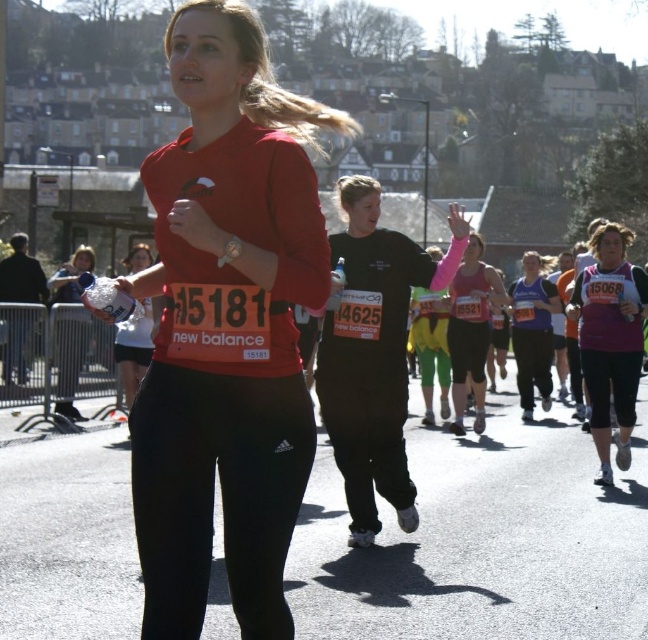
Question: Observing the image, what is the correct spatial positioning of purple matte tank top at center in reference to matte purple tank top at center?

Choices:
 (A) right
 (B) left

Answer: (B)

Question: Can you confirm if pink matte tank top at center is wider than matte black leggings at center?

Choices:
 (A) yes
 (B) no

Answer: (B)

Question: Which of these objects is positioned farthest from the pink matte tank top at center?

Choices:
 (A) matte red shirt at center
 (B) purple matte tank top at center
 (C) matte purple tank top at center

Answer: (A)

Question: Which is nearer to the matte purple tank top at center?

Choices:
 (A) matte red shirt at center
 (B) purple matte tank top at center
 (C) matte black leggings at center
 (D) pink matte tank top at center

Answer: (D)

Question: Which object is farther from the camera taking this photo?

Choices:
 (A) matte red shirt at center
 (B) matte black leggings at center

Answer: (B)

Question: Can you confirm if purple matte tank top at center is positioned below matte purple tank top at center?

Choices:
 (A) yes
 (B) no

Answer: (B)